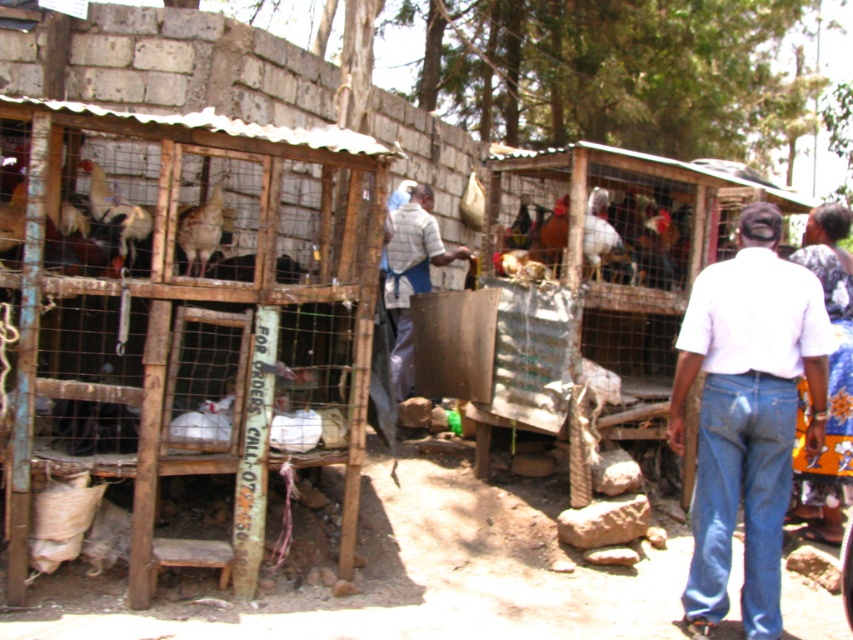
Can you confirm if white cotton shirt at center is smaller than striped fabric shirt at center?

Yes, white cotton shirt at center is smaller than striped fabric shirt at center.

What do you see at coordinates (747, 413) in the screenshot?
I see `white cotton shirt at center` at bounding box center [747, 413].

Does point (787, 376) come closer to viewer compared to point (404, 272)?

That is True.

At what (x,y) coordinates should I click in order to perform the action: click on white cotton shirt at center. Please return your answer as a coordinate pair (x, y). Looking at the image, I should click on (747, 413).